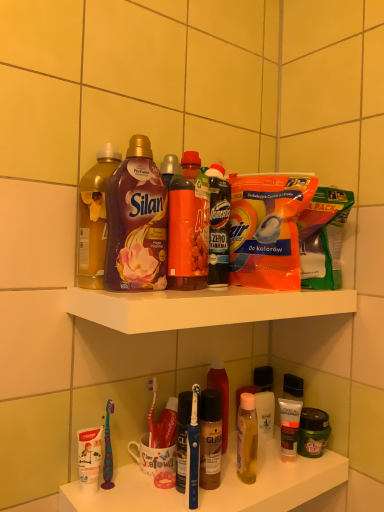
Where is `free area in between matte black hair mask at lower right, which is the first toiletry from front to back, and blue plastic toothbrush at lower center`? free area in between matte black hair mask at lower right, which is the first toiletry from front to back, and blue plastic toothbrush at lower center is located at coordinates (249, 486).